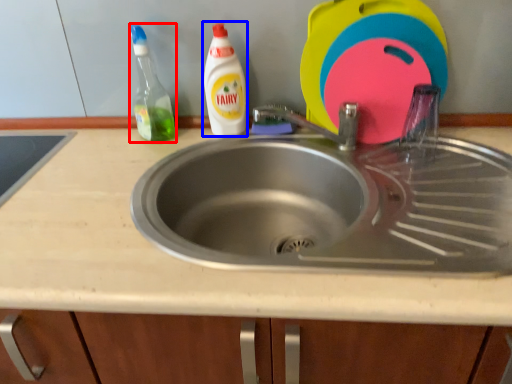
Question: Which object appears farthest to the camera in this image, cleaning product (highlighted by a red box) or cleaning product (highlighted by a blue box)?

Choices:
 (A) cleaning product
 (B) cleaning product

Answer: (B)